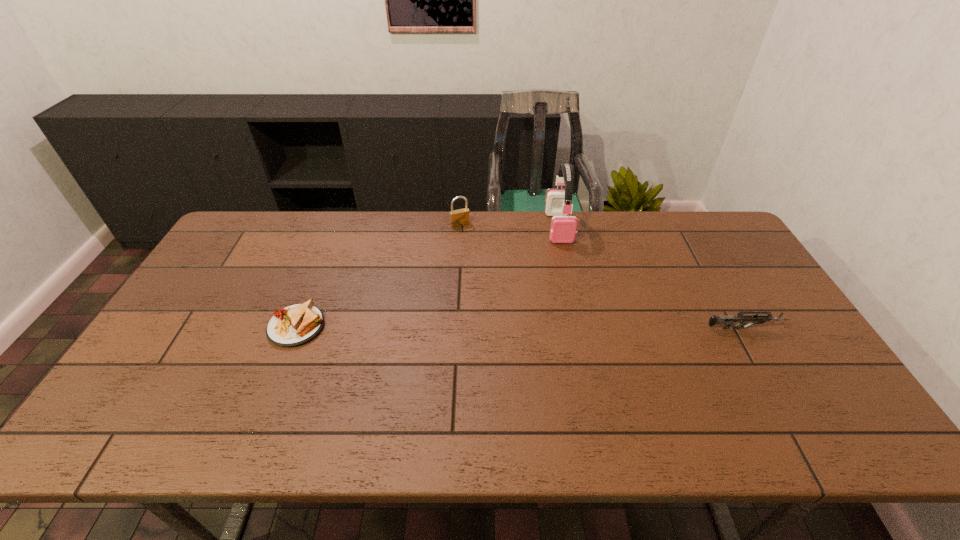
Where is `vacant area that lies between the rightmost object and the third shortest object`? vacant area that lies between the rightmost object and the third shortest object is located at coordinates (602, 276).

Locate an element on the screen. vacant region between the third shortest object and the sandwich is located at coordinates (378, 275).

You are a GUI agent. You are given a task and a screenshot of the screen. Output one action in this format:
    pyautogui.click(x=<x>, y=<y>)
    Task: Click on the free space between the tallest object and the leftmost object
    
    Given the screenshot: What is the action you would take?
    pyautogui.click(x=428, y=277)

The image size is (960, 540). Identify the location of empty space between the rightmost object and the tallest object. (652, 278).

At what (x,y) coordinates should I click in order to perform the action: click on free spot between the second object from left to right and the tallest object. Please return your answer as a coordinate pair (x, y). The height and width of the screenshot is (540, 960). Looking at the image, I should click on (510, 226).

Locate which object ranks third in proximity to the third object from right to left. Please provide its 2D coordinates. Your answer should be formatted as a tuple, i.e. [(x, y)], where the tuple contains the x and y coordinates of a point satisfying the conditions above.

[(727, 321)]

Locate which object ranks third in proximity to the earphone. Please provide its 2D coordinates. Your answer should be formatted as a tuple, i.e. [(x, y)], where the tuple contains the x and y coordinates of a point satisfying the conditions above.

[(295, 325)]

You are a GUI agent. You are given a task and a screenshot of the screen. Output one action in this format:
    pyautogui.click(x=<x>, y=<y>)
    Task: Click on the vacant space that satisfies the following two spatial constraints: 1. on the back side of the sandwich; 2. on the right side of the earphone
    
    Given the screenshot: What is the action you would take?
    (x=336, y=227)

At what (x,y) coordinates should I click in order to perform the action: click on vacant point that satisfies the following two spatial constraints: 1. on the front side of the padlock; 2. aimed along the barrel of the rightmost object. Please return your answer as a coordinate pair (x, y). Looking at the image, I should click on (454, 328).